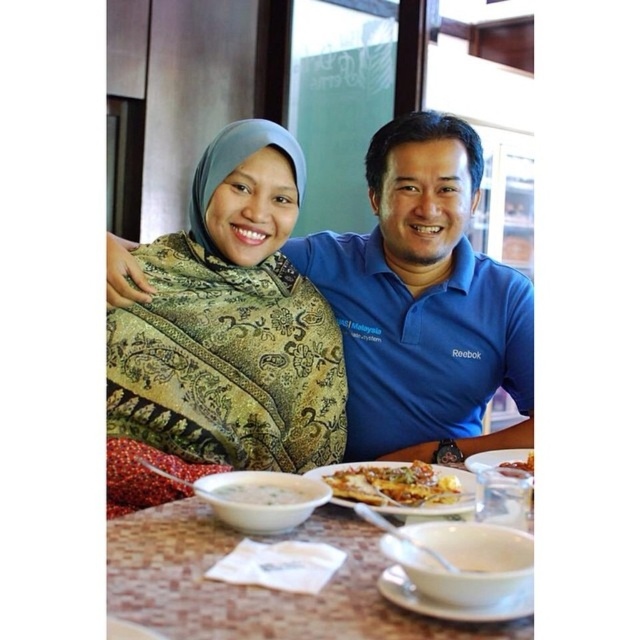
Between point (413, 259) and point (243, 513), which one is positioned in front?

Point (243, 513) is more forward.

Can you confirm if blue cotton shirt at center is shorter than white matte bowl at lower center?

Incorrect, blue cotton shirt at center's height does not fall short of white matte bowl at lower center's.

Which is behind, point (404, 266) or point (250, 509)?

Positioned behind is point (404, 266).

Locate an element on the screen. blue cotton shirt at center is located at coordinates (422, 301).

Which is below, white matte bowl at lower center or golden crispy pizza at center?

Positioned lower is white matte bowl at lower center.

Does white matte bowl at lower center have a larger size compared to golden crispy pizza at center?

Correct, white matte bowl at lower center is larger in size than golden crispy pizza at center.

What do you see at coordinates (260, 499) in the screenshot? I see `white matte bowl at lower center` at bounding box center [260, 499].

Locate an element on the screen. white matte bowl at lower center is located at coordinates (260, 499).

Is point (134, 330) more distant than point (340, 470)?

Yes, it is behind point (340, 470).

Who is taller, green batik scarf at center or golden crispy pizza at center?

green batik scarf at center

Which is behind, point (268, 360) or point (349, 486)?

The point (268, 360) is more distant.

In order to click on green batik scarf at center in this screenshot , I will do `click(230, 323)`.